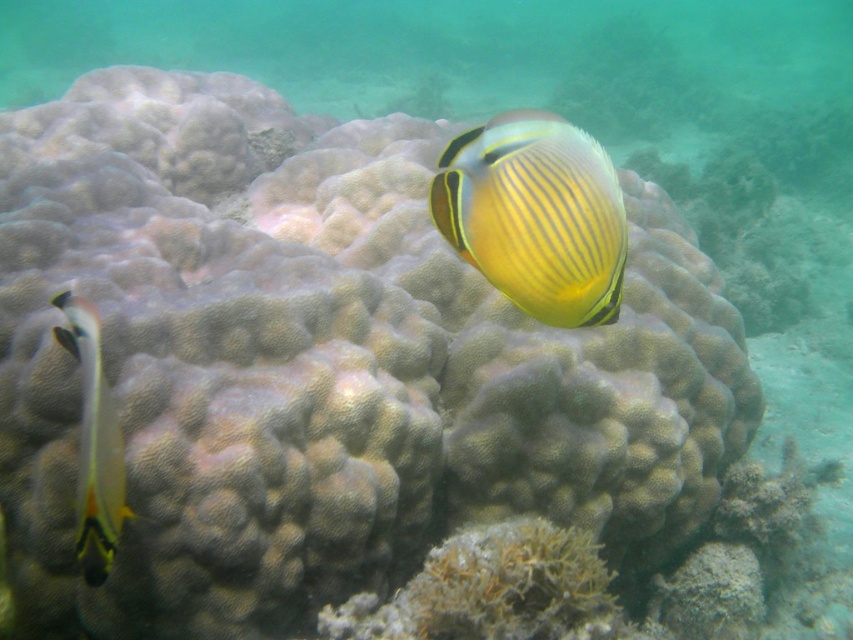
Question: Which of the following is the closest to the observer?

Choices:
 (A) yellow striped fish at center
 (B) translucent yellow and black fish at left

Answer: (B)

Question: Which point is closer to the camera taking this photo?

Choices:
 (A) (531, 259)
 (B) (83, 330)

Answer: (B)

Question: From the image, what is the correct spatial relationship of yellow striped fish at center in relation to translucent yellow and black fish at left?

Choices:
 (A) below
 (B) above

Answer: (B)

Question: Is yellow striped fish at center thinner than translucent yellow and black fish at left?

Choices:
 (A) yes
 (B) no

Answer: (A)

Question: Does yellow striped fish at center lie behind translucent yellow and black fish at left?

Choices:
 (A) no
 (B) yes

Answer: (B)